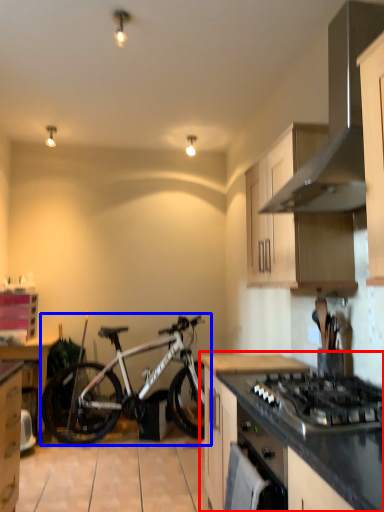
Question: Which object appears farthest to the camera in this image, countertop (highlighted by a red box) or bicycle (highlighted by a blue box)?

Choices:
 (A) countertop
 (B) bicycle

Answer: (B)